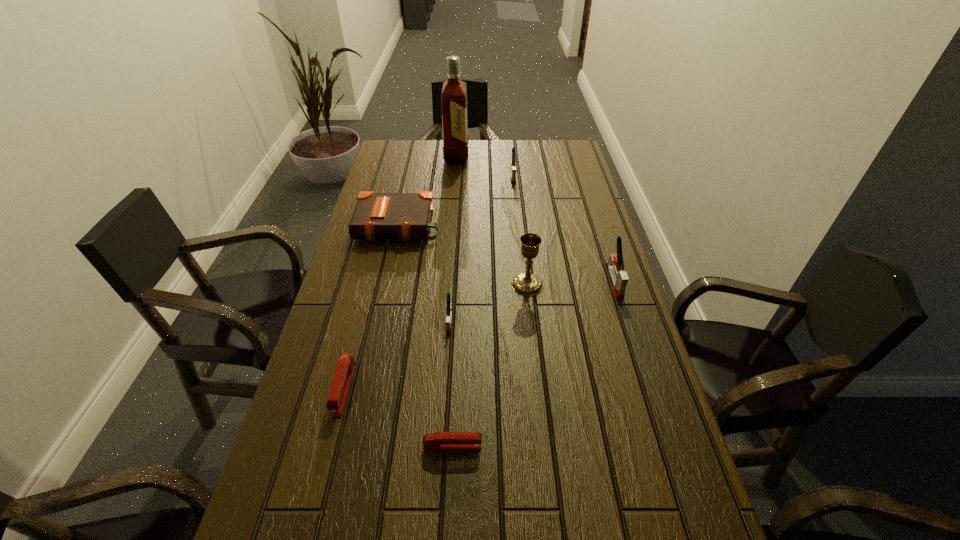
In the image, there is a desktop. Where is `blank space at the far right corner`? The height and width of the screenshot is (540, 960). blank space at the far right corner is located at coordinates (571, 166).

Where is `empty space between the rightmost gray stapler and the third farthest object`? empty space between the rightmost gray stapler and the third farthest object is located at coordinates (506, 253).

This screenshot has width=960, height=540. In order to click on free space between the fourth stapler from left to right and the smallest gray stapler in this screenshot , I will do `click(481, 248)`.

At what (x,y) coordinates should I click in order to perform the action: click on vacant area that lies between the Bible and the right red stapler. Please return your answer as a coordinate pair (x, y). The image size is (960, 540). Looking at the image, I should click on (425, 335).

Locate an element on the screen. The height and width of the screenshot is (540, 960). unoccupied area between the third tallest stapler and the tallest object is located at coordinates (453, 239).

Identify the location of empty space between the chalice and the rightmost gray stapler. (570, 283).

Where is `free space between the bigger red stapler and the sixth shortest object`? Image resolution: width=960 pixels, height=540 pixels. free space between the bigger red stapler and the sixth shortest object is located at coordinates (479, 334).

Locate an element on the screen. free space between the second farthest gray stapler and the Bible is located at coordinates (506, 253).

Point out which object is positioned as the third nearest to the second gray stapler from right to left. Please provide its 2D coordinates. Your answer should be formatted as a tuple, i.e. [(x, y)], where the tuple contains the x and y coordinates of a point satisfying the conditions above.

[(526, 284)]

Find the location of a particular element. The width and height of the screenshot is (960, 540). object that stands as the fifth closest to the second nearest stapler is located at coordinates (615, 266).